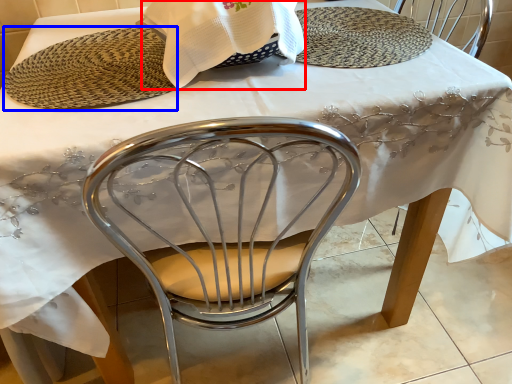
Question: Which object appears farthest to the camera in this image, blanket (highlighted by a red box) or platter (highlighted by a blue box)?

Choices:
 (A) blanket
 (B) platter

Answer: (B)